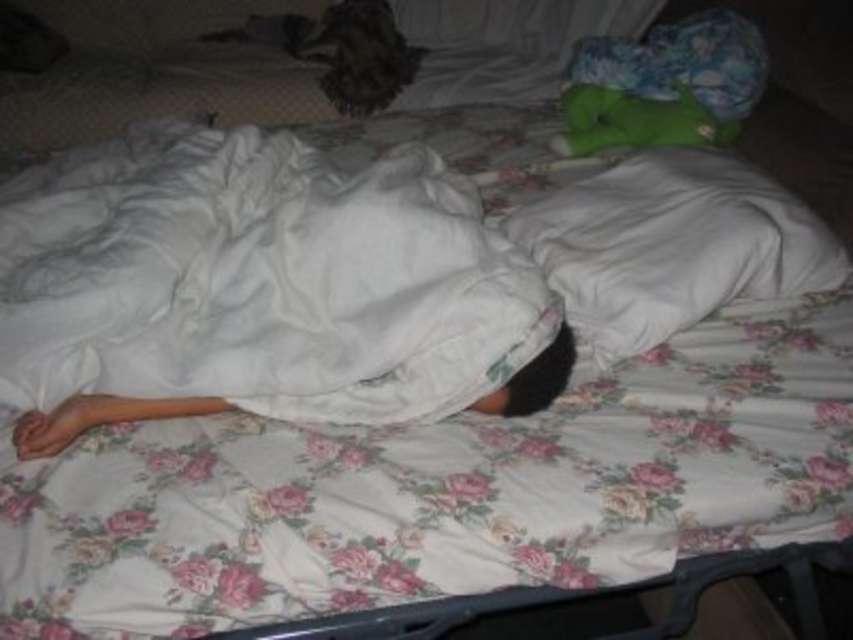
You are a delivery robot entering a dimly lit room and need to place a package on the bed without disturbing the white cotton blanket at center. Where should you place the package?

The white cotton blanket at center is located at point (x=260, y=280), so you should place the package away from that position to avoid disturbing it.

You are a photographer trying to capture the fuzzy brown cat at upper center. To get a clear shot, you need to know if the cat is on top of or under the white cotton blanket at center. Based on the scene description, can you determine this?

The white cotton blanket at center is positioned under the fuzzy brown cat at upper center, so the cat is on top of the blanket.

You are a delivery robot entering a dimly lit room. You need to place a small package on the bed without disturbing the person. The bed has a white cotton blanket at center and a fuzzy brown cat at upper center. Where should you place the package?

The white cotton blanket at center is taller than the fuzzy brown cat at upper center. You should place the package on the white cotton blanket at center since it has more vertical space available compared to the fuzzy brown cat at upper center.